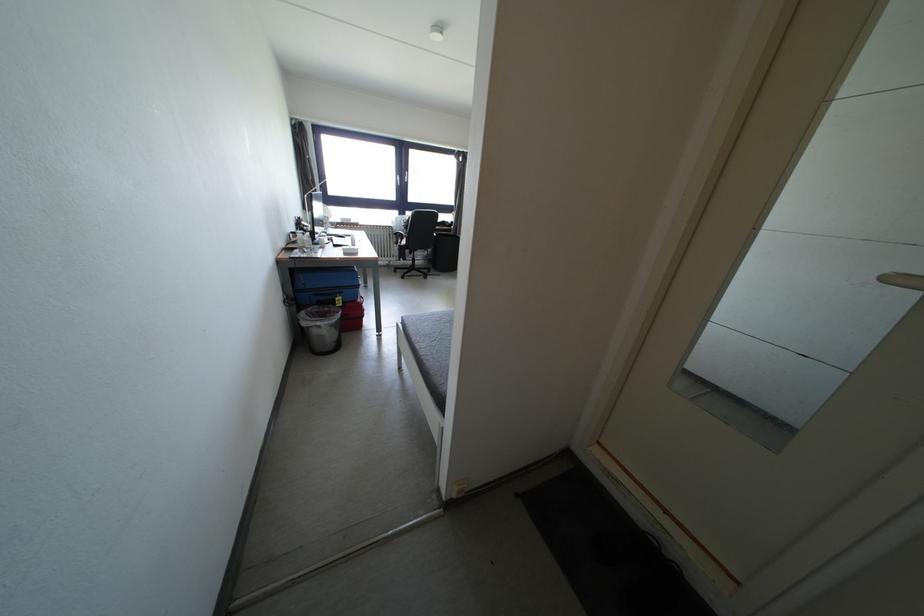
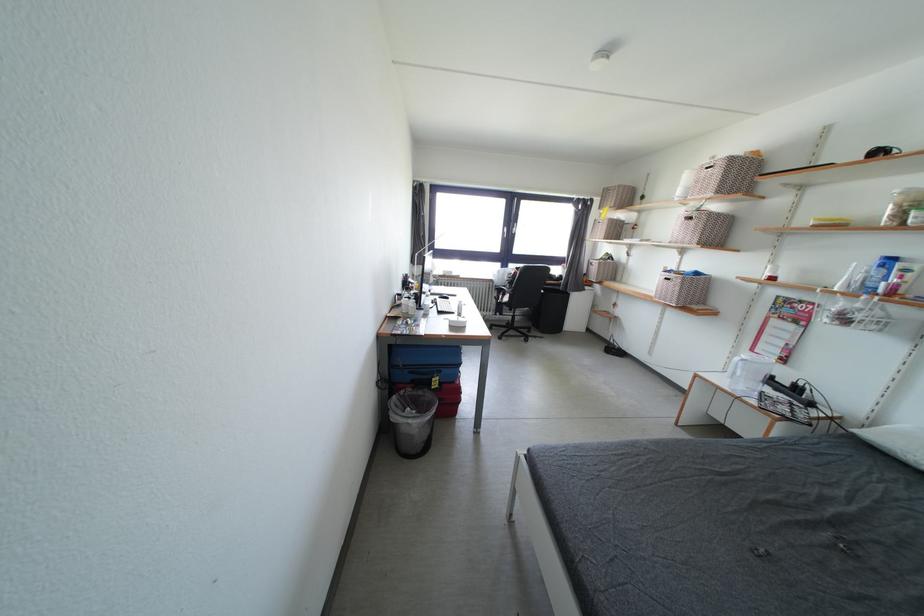
Locate, in the second image, the point that corresponds to point 410,219 in the first image.

(514, 270)